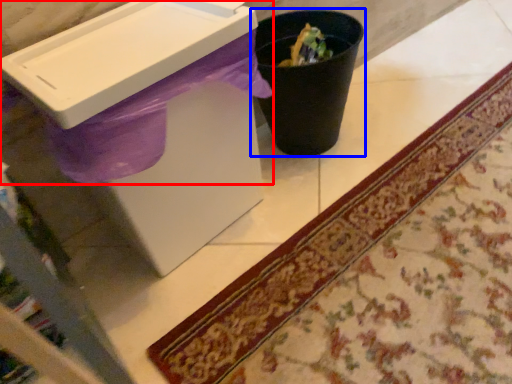
Question: Among these objects, which one is nearest to the camera, sink (highlighted by a red box) or waste container (highlighted by a blue box)?

Choices:
 (A) sink
 (B) waste container

Answer: (A)